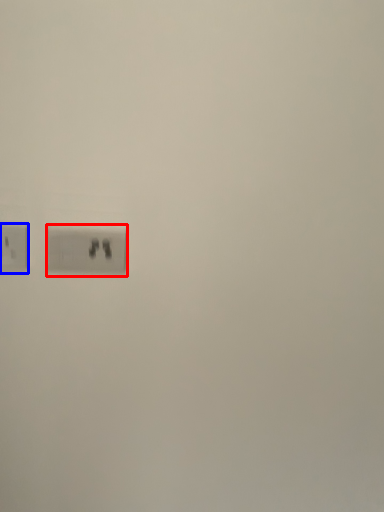
Question: Which object appears farthest to the camera in this image, power plugs and sockets (highlighted by a red box) or power plugs and sockets (highlighted by a blue box)?

Choices:
 (A) power plugs and sockets
 (B) power plugs and sockets

Answer: (A)